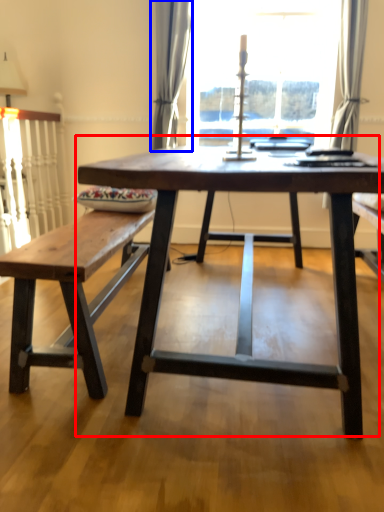
Question: Which object appears closest to the camera in this image, coffee table (highlighted by a red box) or curtain (highlighted by a blue box)?

Choices:
 (A) coffee table
 (B) curtain

Answer: (A)